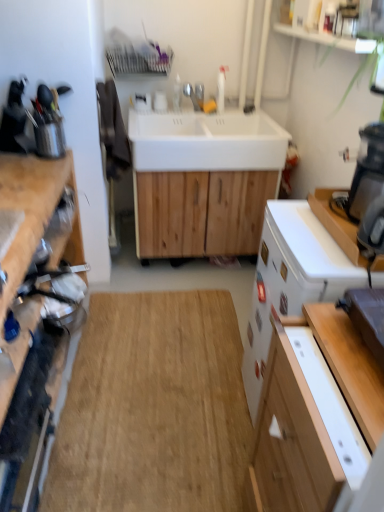
This screenshot has height=512, width=384. I want to click on vacant space underneath natural wood table at center (from a real-world perspective), so click(x=161, y=410).